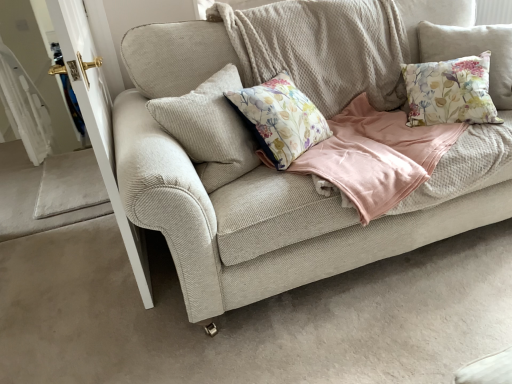
Identify the location of white glossy door handle at left. The height and width of the screenshot is (384, 512). (98, 122).

The image size is (512, 384). Identify the location of floral fabric cushion at upper right, which is the second pillow from left to right. (473, 52).

Locate an element on the screen. The image size is (512, 384). beige corduroy couch at center is located at coordinates (x=295, y=174).

Find the location of a particular element. This screenshot has width=512, height=384. white glossy door handle at left is located at coordinates (98, 122).

Is floral fabric cushion at upper right, positioned as the 2th pillow in right-to-left order, located within floral fabric cushion at upper right, which is the second pillow from left to right?

That's correct, floral fabric cushion at upper right, positioned as the 2th pillow in right-to-left order, is inside floral fabric cushion at upper right, which is the second pillow from left to right.

Does floral fabric cushion at upper right, which is the second pillow from left to right, appear on the right side of floral fabric cushion at upper right, positioned as the 2th pillow in right-to-left order?

Indeed, floral fabric cushion at upper right, which is the second pillow from left to right, is positioned on the right side of floral fabric cushion at upper right, positioned as the 2th pillow in right-to-left order.

Locate an element on the screen. This screenshot has height=384, width=512. pillow above the floral fabric cushion at upper right, positioned as the 2th pillow in right-to-left order (from the image's perspective) is located at coordinates (473, 52).

Is floral fabric cushion at upper right, which is the second pillow from left to right, wider than floral fabric cushion at upper right, positioned as the 2th pillow in right-to-left order?

Yes.

Does point (86, 57) come farther from viewer compared to point (490, 45)?

No.

Does white glossy door handle at left turn towards floral fabric cushion at upper right, which is the second pillow from left to right?

No, white glossy door handle at left is not oriented towards floral fabric cushion at upper right, which is the second pillow from left to right.

From the image's perspective, is white glossy door handle at left above or below floral fabric cushion at upper right, which is the second pillow from left to right?

From the image's perspective, white glossy door handle at left appears below floral fabric cushion at upper right, which is the second pillow from left to right.

From the image's perspective, does floral fabric cushion at upper right, acting as the first pillow starting from the right, appear lower than beige corduroy couch at center?

Incorrect, from the image's perspective, floral fabric cushion at upper right, acting as the first pillow starting from the right, is higher than beige corduroy couch at center.

Is floral fabric cushion at upper right, which is the second pillow from left to right, aimed at beige corduroy couch at center?

Yes, floral fabric cushion at upper right, which is the second pillow from left to right, faces towards beige corduroy couch at center.

Would you consider floral fabric cushion at upper right, acting as the first pillow starting from the right, to be distant from beige corduroy couch at center?

No, floral fabric cushion at upper right, acting as the first pillow starting from the right, is not far away from beige corduroy couch at center.

Can we say floral fabric cushion at upper right, which is the second pillow from left to right, lies outside beige corduroy couch at center?

That's incorrect, floral fabric cushion at upper right, which is the second pillow from left to right, is not completely outside beige corduroy couch at center.

Is beige corduroy couch at center with floral fabric cushion at upper right, positioned as the 2th pillow in right-to-left order?

No, beige corduroy couch at center is not making contact with floral fabric cushion at upper right, positioned as the 2th pillow in right-to-left order.

Does beige corduroy couch at center turn towards floral fabric cushion at upper right, the 1th pillow from the left?

Yes, beige corduroy couch at center faces towards floral fabric cushion at upper right, the 1th pillow from the left.

Consider the image. Does beige corduroy couch at center appear on the right side of floral fabric cushion at upper right, the 1th pillow from the left?

No.

Is point (130, 141) less distant than point (466, 79)?

That is True.

From the image's perspective, which one is positioned lower, floral fabric cushion at upper right, positioned as the 2th pillow in right-to-left order, or floral fabric cushion at upper right, acting as the first pillow starting from the right?

floral fabric cushion at upper right, positioned as the 2th pillow in right-to-left order, appears lower in the image.

From a real-world perspective, is floral fabric cushion at upper right, the 1th pillow from the left, above or below floral fabric cushion at upper right, which is the second pillow from left to right?

floral fabric cushion at upper right, the 1th pillow from the left, is below floral fabric cushion at upper right, which is the second pillow from left to right.

Locate an element on the screen. pillow below the floral fabric cushion at upper right, acting as the first pillow starting from the right (from a real-world perspective) is located at coordinates (450, 92).

Are floral fabric cushion at upper right, the 1th pillow from the left, and floral fabric cushion at upper right, which is the second pillow from left to right, beside each other?

No, floral fabric cushion at upper right, the 1th pillow from the left, is not touching floral fabric cushion at upper right, which is the second pillow from left to right.

Could you tell me if floral fabric cushion at upper right, positioned as the 2th pillow in right-to-left order, is turned towards beige corduroy couch at center?

Yes, floral fabric cushion at upper right, positioned as the 2th pillow in right-to-left order, is turned towards beige corduroy couch at center.

Considering the relative sizes of floral fabric cushion at upper right, the 1th pillow from the left, and beige corduroy couch at center in the image provided, is floral fabric cushion at upper right, the 1th pillow from the left, bigger than beige corduroy couch at center?

Incorrect, floral fabric cushion at upper right, the 1th pillow from the left, is not larger than beige corduroy couch at center.

Is point (471, 105) positioned behind point (444, 165)?

Yes.

Is floral fabric cushion at upper right, the 1th pillow from the left, closer to the viewer compared to beige corduroy couch at center?

That is False.

Are floral fabric cushion at upper right, positioned as the 2th pillow in right-to-left order, and white glossy door handle at left making contact?

No, floral fabric cushion at upper right, positioned as the 2th pillow in right-to-left order, is not beside white glossy door handle at left.

Does floral fabric cushion at upper right, positioned as the 2th pillow in right-to-left order, have a lesser height compared to white glossy door handle at left?

Yes.

Considering the sizes of objects floral fabric cushion at upper right, positioned as the 2th pillow in right-to-left order, and white glossy door handle at left in the image provided, who is thinner, floral fabric cushion at upper right, positioned as the 2th pillow in right-to-left order, or white glossy door handle at left?

With smaller width is white glossy door handle at left.

What are the coordinates of `pillow behind the floral fabric cushion at upper right, the 1th pillow from the left` in the screenshot? It's located at (473, 52).

In the image, there is a floral fabric cushion at upper right, which is the second pillow from left to right. Where is `screen door below it (from a real-world perspective)`? screen door below it (from a real-world perspective) is located at coordinates (98, 122).

Considering their positions, is beige corduroy couch at center positioned closer to floral fabric cushion at upper right, the 1th pillow from the left, than white glossy door handle at left?

beige corduroy couch at center.

When comparing their distances from beige corduroy couch at center, does floral fabric cushion at upper right, acting as the first pillow starting from the right, or white glossy door handle at left seem further?

white glossy door handle at left is positioned further to the anchor beige corduroy couch at center.

Based on their spatial positions, is beige corduroy couch at center or floral fabric cushion at upper right, the 1th pillow from the left, closer to white glossy door handle at left?

Among the two, beige corduroy couch at center is located nearer to white glossy door handle at left.

From the image, which object appears to be nearer to floral fabric cushion at upper right, the 1th pillow from the left, floral fabric cushion at upper right, acting as the first pillow starting from the right, or white glossy door handle at left?

Based on the image, floral fabric cushion at upper right, acting as the first pillow starting from the right, appears to be nearer to floral fabric cushion at upper right, the 1th pillow from the left.

From the picture: Considering their positions, is beige corduroy couch at center positioned further to floral fabric cushion at upper right, which is the second pillow from left to right, than floral fabric cushion at upper right, the 1th pillow from the left?

beige corduroy couch at center is further to floral fabric cushion at upper right, which is the second pillow from left to right.

Based on their spatial positions, is floral fabric cushion at upper right, acting as the first pillow starting from the right, or floral fabric cushion at upper right, positioned as the 2th pillow in right-to-left order, further from white glossy door handle at left?

Based on the image, floral fabric cushion at upper right, acting as the first pillow starting from the right, appears to be further to white glossy door handle at left.

Looking at the image, which one is located further to beige corduroy couch at center, floral fabric cushion at upper right, positioned as the 2th pillow in right-to-left order, or white glossy door handle at left?

white glossy door handle at left.

Estimate the real-world distances between objects in this image. Which object is closer to floral fabric cushion at upper right, which is the second pillow from left to right, floral fabric cushion at upper right, positioned as the 2th pillow in right-to-left order, or white glossy door handle at left?

Based on the image, floral fabric cushion at upper right, positioned as the 2th pillow in right-to-left order, appears to be nearer to floral fabric cushion at upper right, which is the second pillow from left to right.

In order to click on pillow between white glossy door handle at left and floral fabric cushion at upper right, which is the second pillow from left to right, in the horizontal direction in this screenshot , I will do `click(450, 92)`.

Find the location of a particular element. Image resolution: width=512 pixels, height=384 pixels. pillow between beige corduroy couch at center and floral fabric cushion at upper right, acting as the first pillow starting from the right, along the z-axis is located at coordinates (450, 92).

Where is `studio couch between white glossy door handle at left and floral fabric cushion at upper right, acting as the first pillow starting from the right, in the horizontal direction`? This screenshot has width=512, height=384. studio couch between white glossy door handle at left and floral fabric cushion at upper right, acting as the first pillow starting from the right, in the horizontal direction is located at coordinates (295, 174).

This screenshot has height=384, width=512. In order to click on studio couch between white glossy door handle at left and floral fabric cushion at upper right, positioned as the 2th pillow in right-to-left order, in the horizontal direction in this screenshot , I will do `click(295, 174)`.